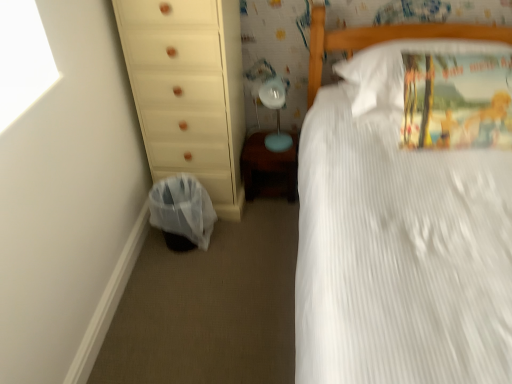
Locate an element on the screen. Image resolution: width=512 pixels, height=384 pixels. vacant space in between white wood chest of drawers at left and wooden changing table at lower center is located at coordinates (261, 209).